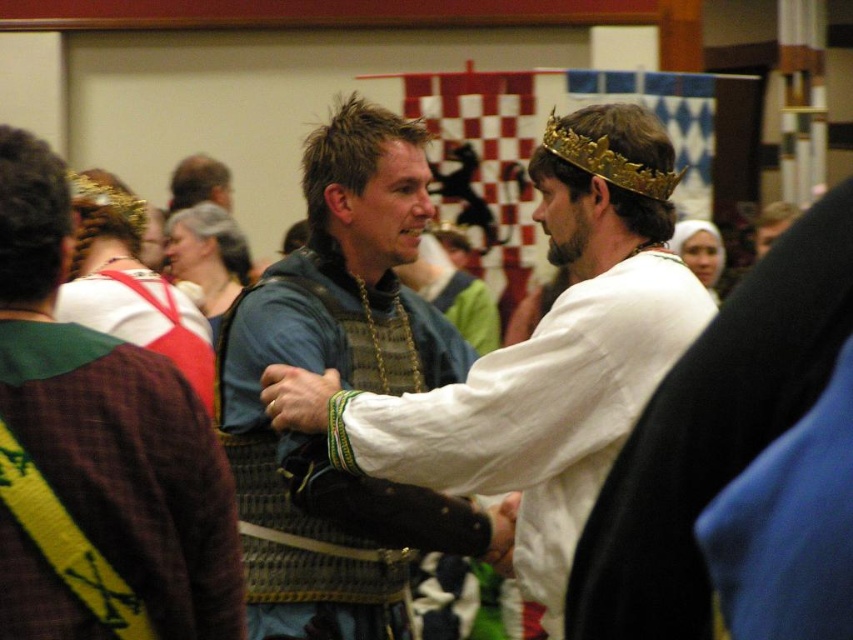
You are organizing a costume party and need to ensure that the matte blue armor at center and the green fabric sash at left fit on a display table. The table has limited space. Based on the image, which object requires more space due to its size?

The matte blue armor at center requires more space because it is bigger than the green fabric sash at left.